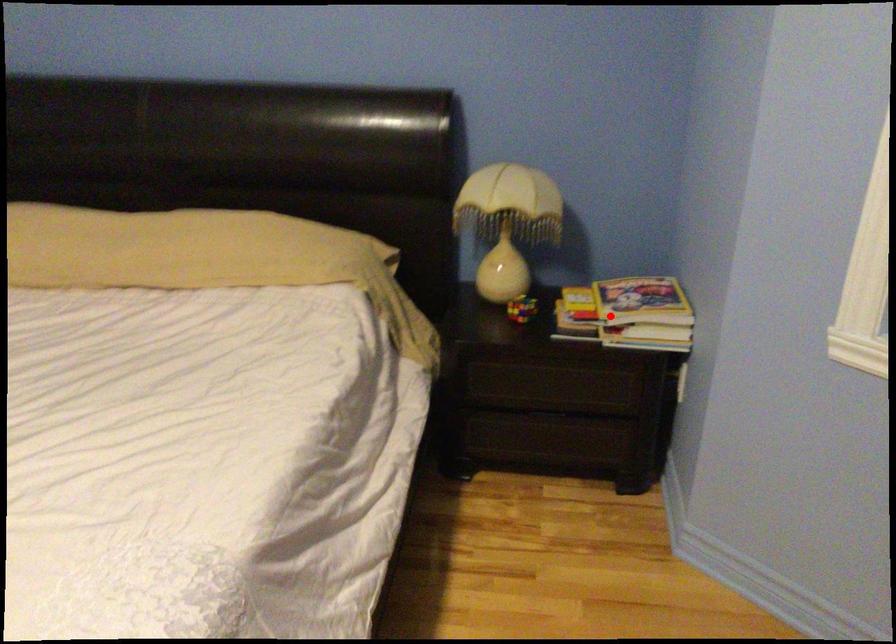
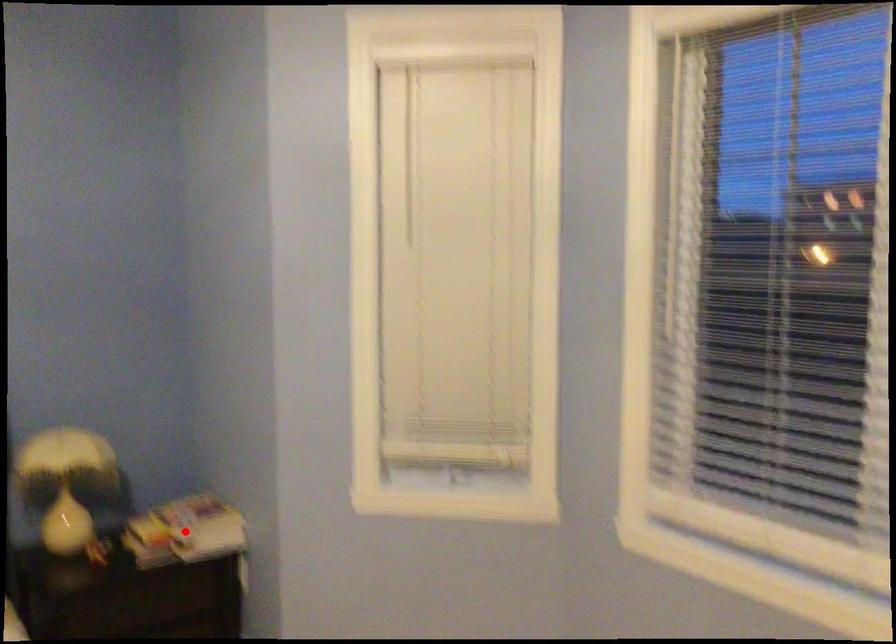
I am providing you with two images of the same scene from different viewpoints. A red point is marked on the first image and another point is marked on the second image. Is the marked point in image1 the same physical position as the marked point in image2?

Yes